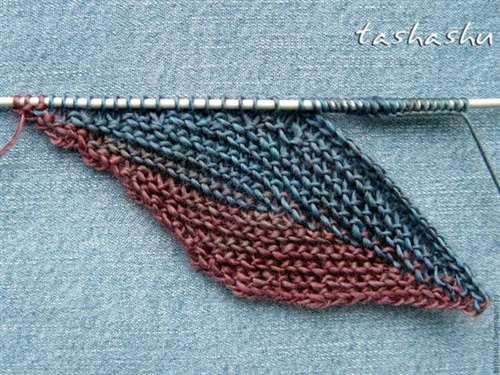
The height and width of the screenshot is (375, 500). Identify the location of corners. (475, 302), (231, 287), (38, 117), (315, 116).